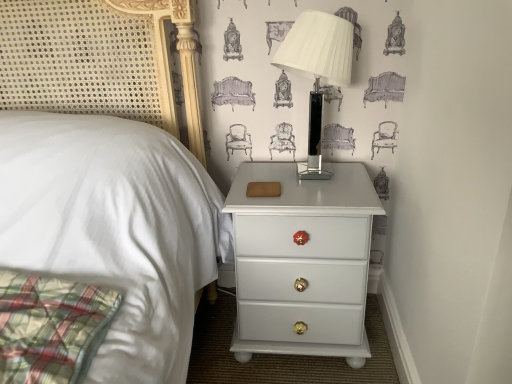
Find the location of a particular element. This screenshot has height=384, width=512. free spot in front of white glossy table lamp at upper right is located at coordinates (317, 197).